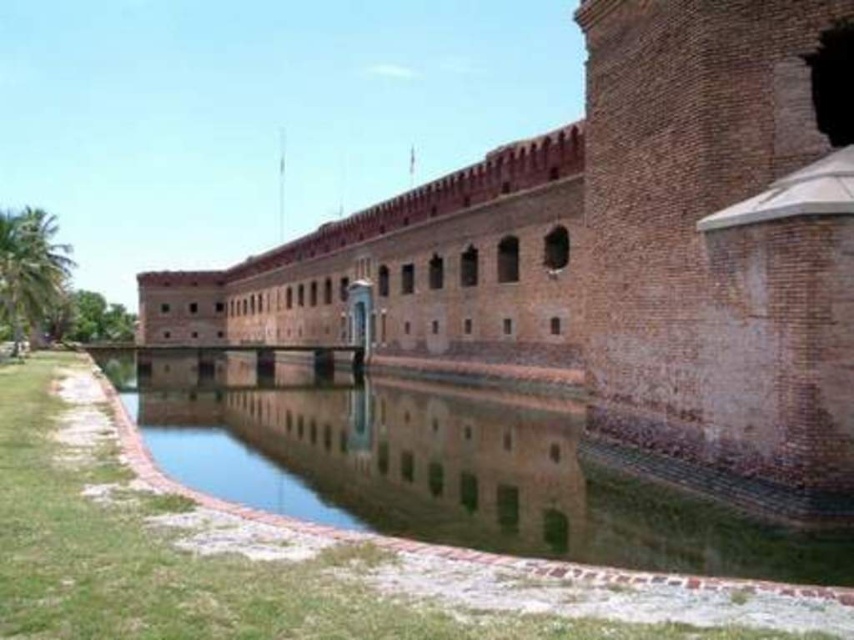
Question: Is brown brick wall at center behind clear water at center?

Choices:
 (A) no
 (B) yes

Answer: (B)

Question: Which object appears closest to the camera in this image?

Choices:
 (A) brown brick wall at center
 (B) clear water at center

Answer: (B)

Question: Can you confirm if brown brick wall at center is bigger than clear water at center?

Choices:
 (A) no
 (B) yes

Answer: (B)

Question: Which object appears closest to the camera in this image?

Choices:
 (A) brown brick wall at center
 (B) clear water at center

Answer: (B)

Question: Is brown brick wall at center closer to camera compared to clear water at center?

Choices:
 (A) no
 (B) yes

Answer: (A)